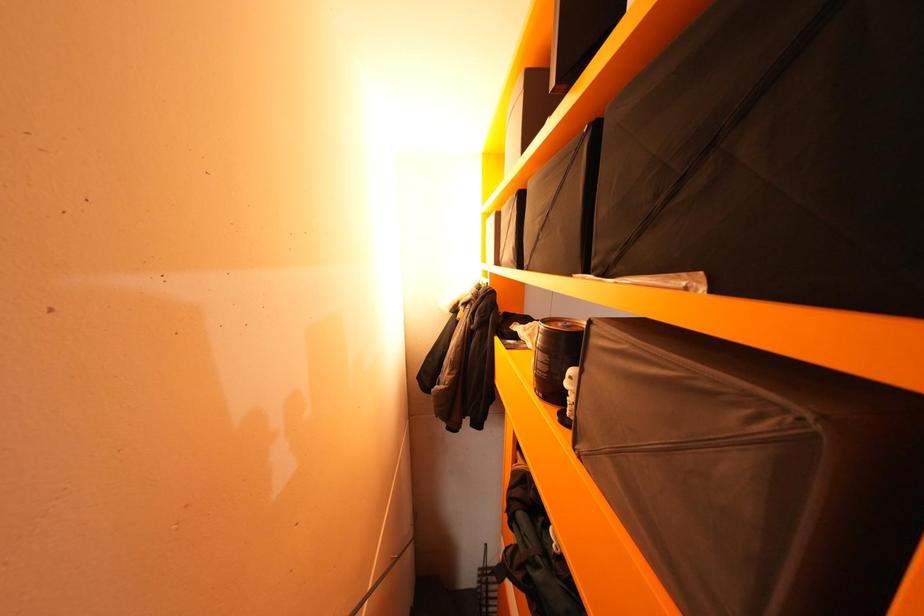
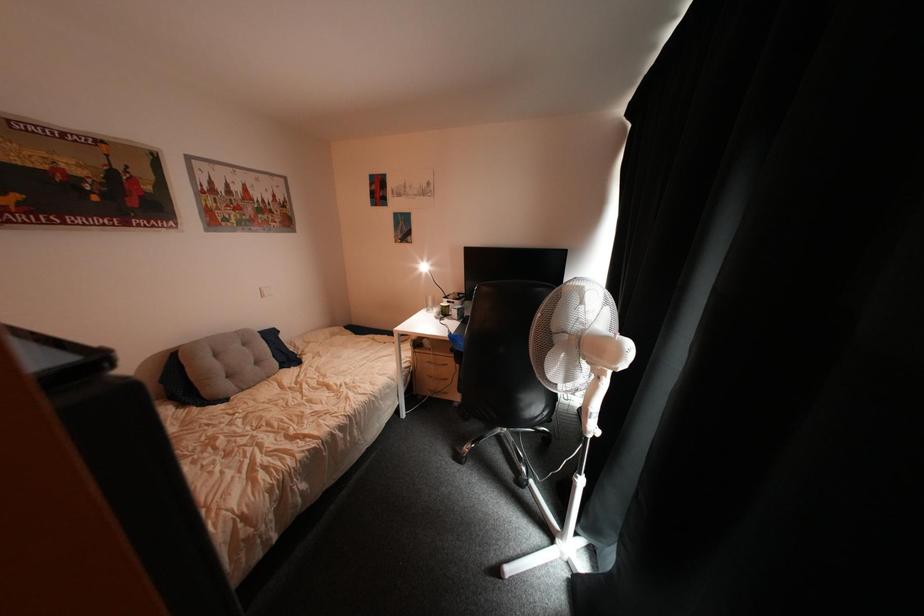
Question: The images are taken continuously from a first-person perspective. In which direction is your viewpoint rotating?

Choices:
 (A) Left
 (B) Right
 (C) Up
 (D) Down

Answer: (B)